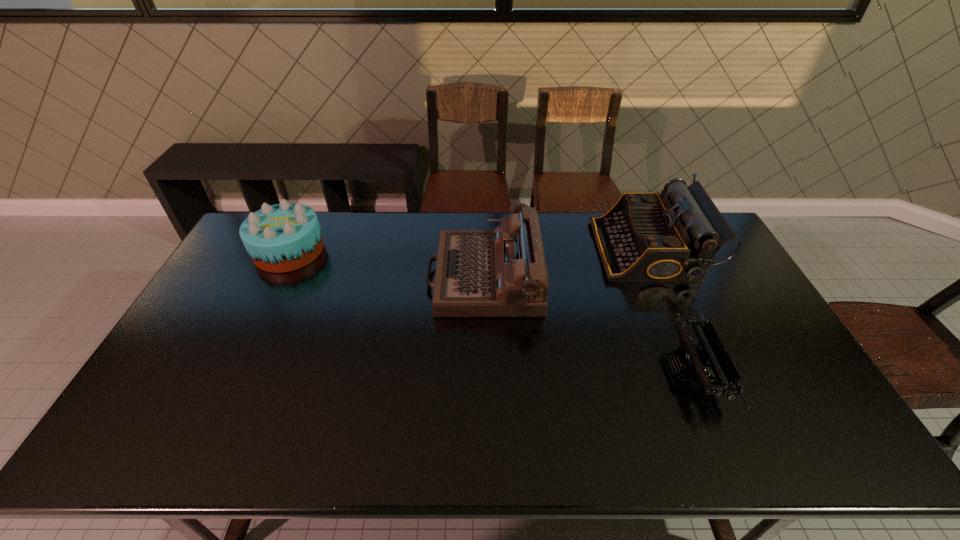
The image size is (960, 540). Identify the location of vacant space located 0.140m on the typing side of the shortest typewriter. (613, 373).

Where is `vacant space located on the typing side of the shortest typewriter`? vacant space located on the typing side of the shortest typewriter is located at coordinates (536, 373).

Where is `cake that is at the far edge`? The image size is (960, 540). cake that is at the far edge is located at coordinates (284, 237).

At what (x,y) coordinates should I click in order to perform the action: click on object that is at the left edge. Please return your answer as a coordinate pair (x, y). Looking at the image, I should click on (284, 237).

I want to click on object located at the right edge, so click(645, 236).

Image resolution: width=960 pixels, height=540 pixels. Find the location of `object that is at the far left corner`. object that is at the far left corner is located at coordinates (284, 237).

At what (x,y) coordinates should I click in order to perform the action: click on object that is at the far right corner. Please return your answer as a coordinate pair (x, y). Image resolution: width=960 pixels, height=540 pixels. Looking at the image, I should click on (645, 236).

Locate an element on the screen. vacant space at the far edge is located at coordinates (372, 244).

This screenshot has width=960, height=540. What are the coordinates of `vacant space at the left edge of the desktop` in the screenshot? It's located at (235, 320).

Where is `vacant space at the right edge of the desktop`? The image size is (960, 540). vacant space at the right edge of the desktop is located at coordinates (745, 324).